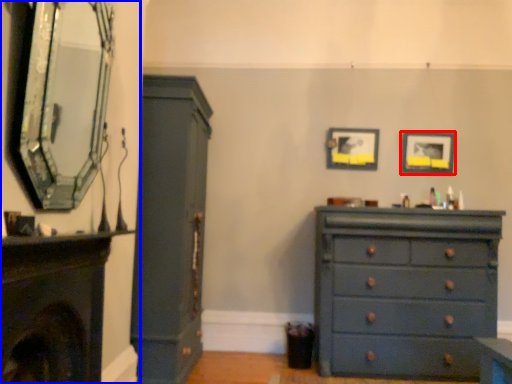
Question: Which of the following is the farthest to the observer, picture frame (highlighted by a red box) or fireplace (highlighted by a blue box)?

Choices:
 (A) picture frame
 (B) fireplace

Answer: (A)